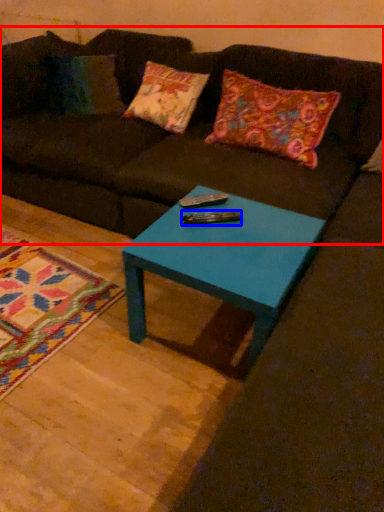
Question: Which object appears closest to the camera in this image, studio couch (highlighted by a red box) or remote (highlighted by a blue box)?

Choices:
 (A) studio couch
 (B) remote

Answer: (A)